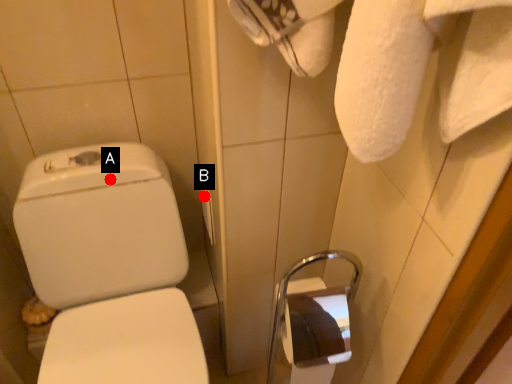
Question: Two points are circled on the image, labeled by A and B beside each circle. Which point is farther from the camera taking this photo?

Choices:
 (A) A is further
 (B) B is further

Answer: (B)